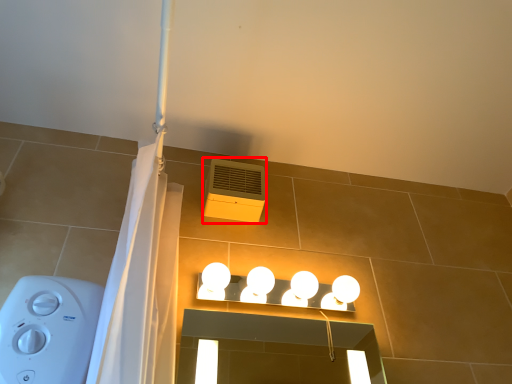
Question: Considering the relative positions of air conditioning (annotated by the red box) and lamp in the image provided, where is air conditioning (annotated by the red box) located with respect to the staircase?

Choices:
 (A) left
 (B) right

Answer: (A)